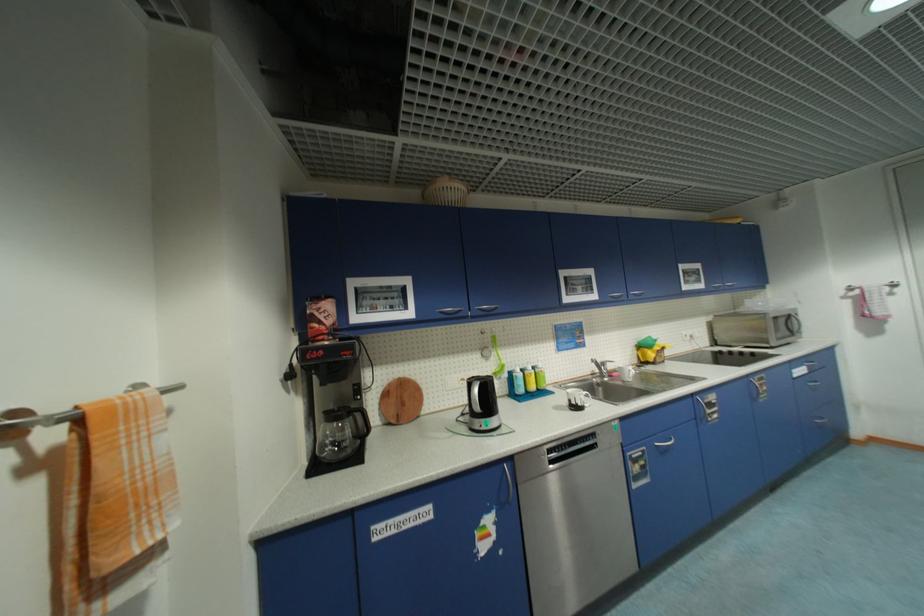
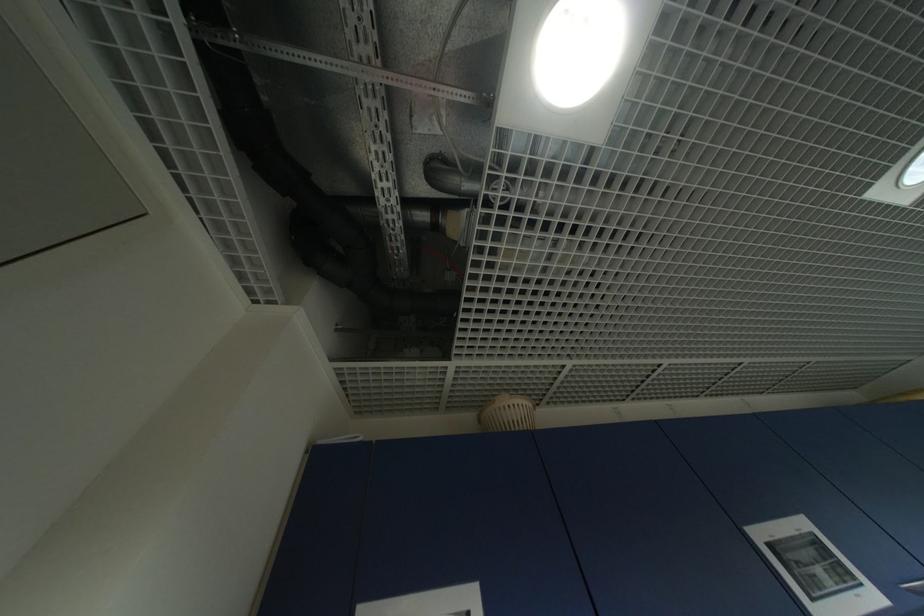
Question: Based on the continuous images, in which direction is the camera rotating? Reply with the corresponding letter.

Choices:
 (A) Left
 (B) Right
 (C) Up
 (D) Down

Answer: (C)